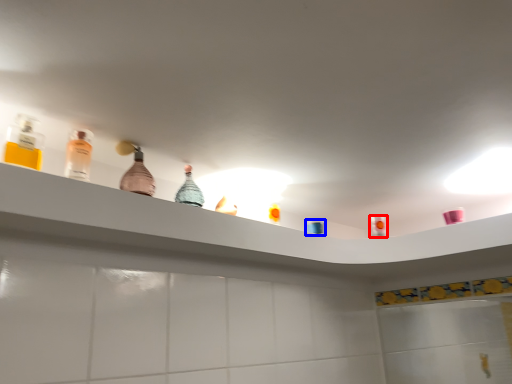
Question: Among these objects, which one is nearest to the camera, mouthwash (highlighted by a red box) or toiletry (highlighted by a blue box)?

Choices:
 (A) mouthwash
 (B) toiletry

Answer: (B)